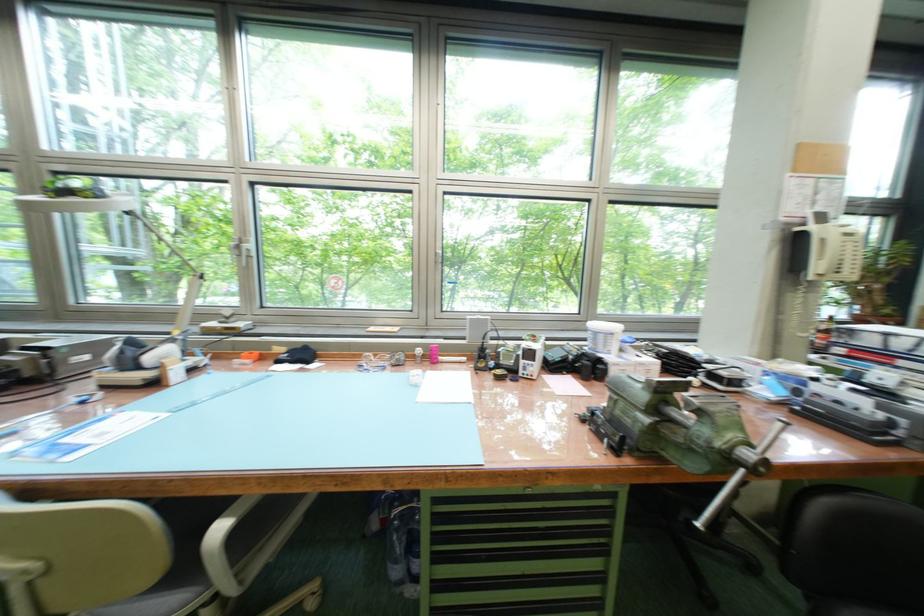
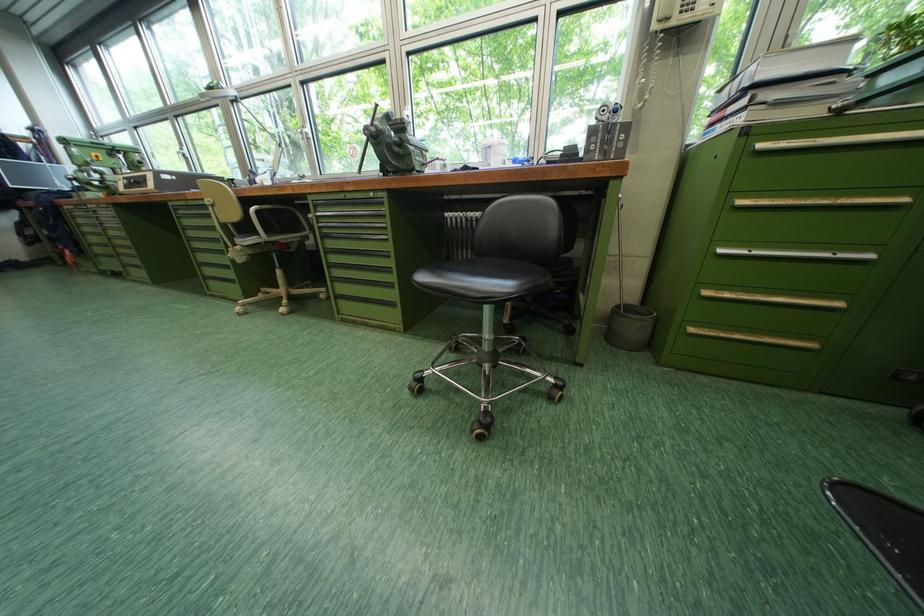
Question: In a continuous first-person perspective shot, in which direction is the camera moving?

Choices:
 (A) Left
 (B) Right
 (C) Forward
 (D) Backward

Answer: (B)